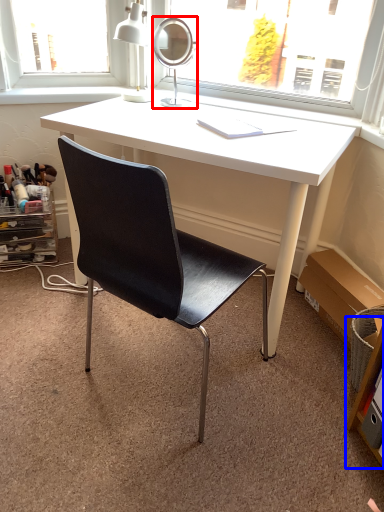
Question: Which point is further to the camera, mirror (highlighted by a red box) or shelf (highlighted by a blue box)?

Choices:
 (A) mirror
 (B) shelf

Answer: (A)